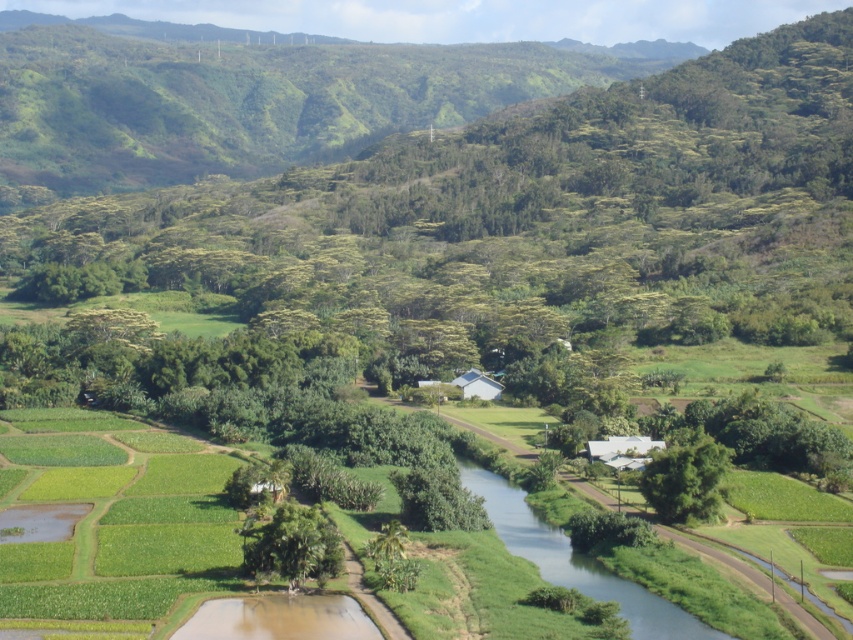
Is green grassy stream at center smaller than green leafy tree at center-right?

Actually, green grassy stream at center might be larger than green leafy tree at center-right.

Is green grassy stream at center below green leafy tree at center-right?

Indeed, green grassy stream at center is positioned under green leafy tree at center-right.

This screenshot has width=853, height=640. Describe the element at coordinates (576, 561) in the screenshot. I see `green grassy stream at center` at that location.

I want to click on green grassy stream at center, so click(576, 561).

Is green grassy stream at center bigger than green leafy tree at center?

Indeed, green grassy stream at center has a larger size compared to green leafy tree at center.

Is green grassy stream at center in front of green leafy tree at center?

Yes, it is.

Which is in front, point (718, 632) or point (276, 518)?

Point (718, 632) is more forward.

I want to click on green grassy stream at center, so click(576, 561).

Between point (325, 538) and point (709, 486), which one is positioned behind?

Point (709, 486)

Identify the location of green leafy tree at center. (292, 545).

I want to click on green leafy tree at center, so click(x=292, y=545).